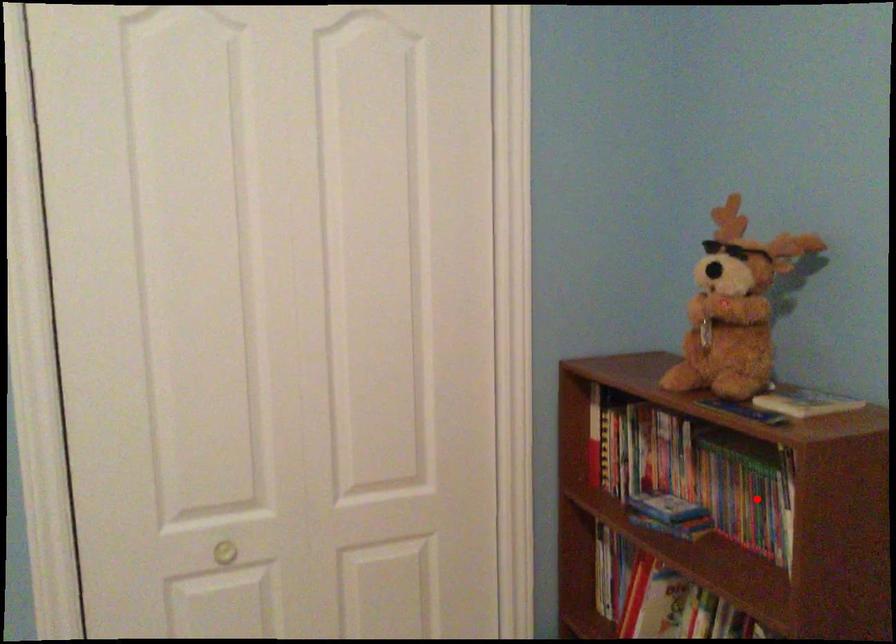
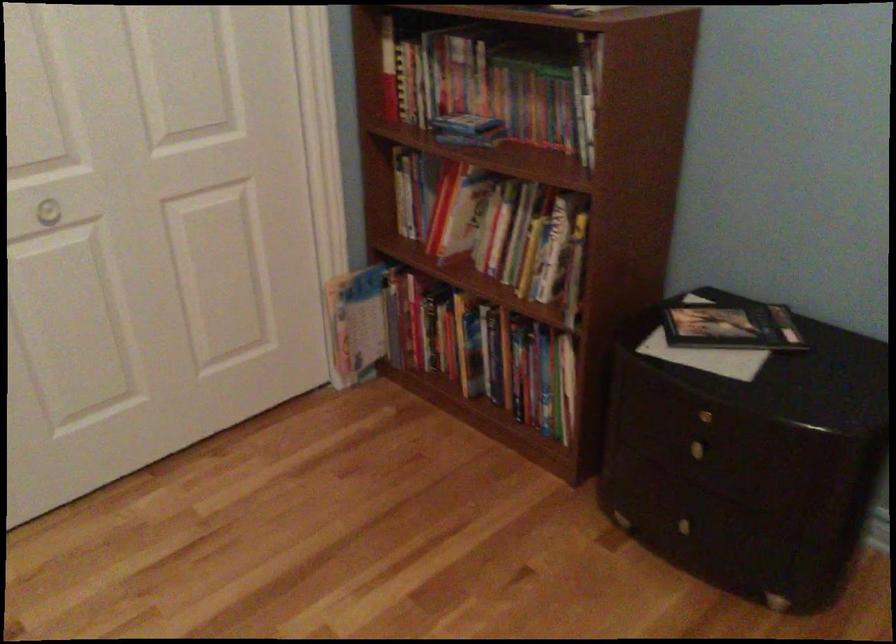
The point at the highlighted location is marked in the first image. Where is the corresponding point in the second image?

(545, 102)